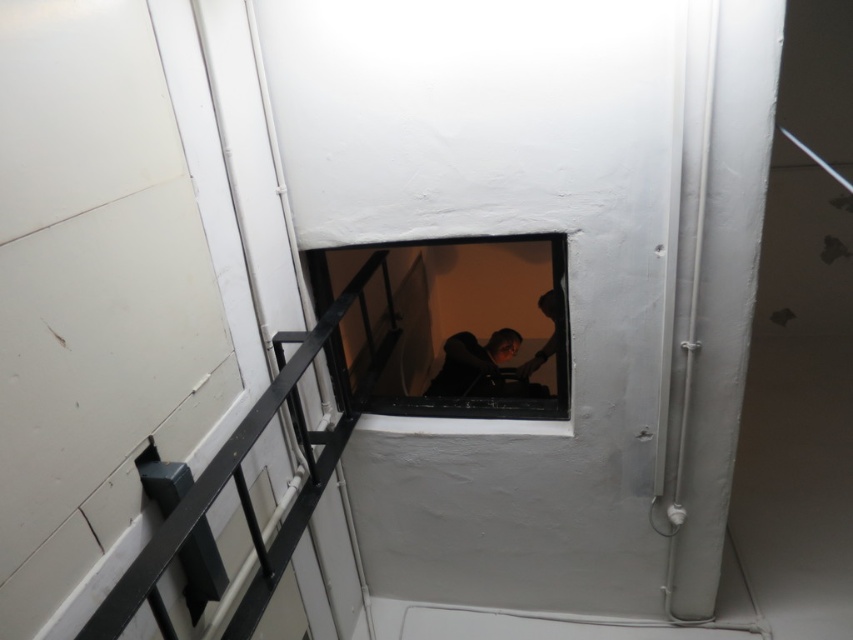
Question: Which point appears farthest from the camera in this image?

Choices:
 (A) (538, 412)
 (B) (492, 339)

Answer: (B)

Question: Can you confirm if transparent glass window at center is thinner than dark hair at center?

Choices:
 (A) no
 (B) yes

Answer: (A)

Question: Does transparent glass window at center come in front of smooth skin person at center?

Choices:
 (A) yes
 (B) no

Answer: (A)

Question: Considering the relative positions of dark hair at center and smooth skin person at center in the image provided, where is dark hair at center located with respect to smooth skin person at center?

Choices:
 (A) below
 (B) above

Answer: (A)

Question: Which object appears farthest from the camera in this image?

Choices:
 (A) smooth skin person at center
 (B) transparent glass window at center
 (C) dark hair at center

Answer: (C)

Question: Which object is the farthest from the transparent glass window at center?

Choices:
 (A) dark hair at center
 (B) smooth skin person at center

Answer: (B)